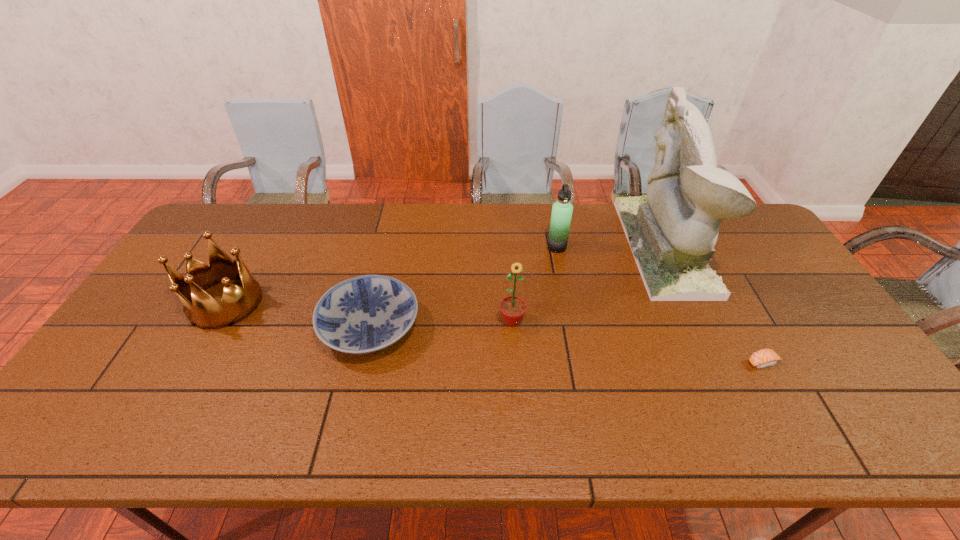
Identify the location of vacant area that lies between the fourth object from right to left and the thermos bottle. The width and height of the screenshot is (960, 540). (535, 284).

The image size is (960, 540). Find the location of `vacant space that is in between the leftmost object and the thermos bottle`. vacant space that is in between the leftmost object and the thermos bottle is located at coordinates (391, 275).

At what (x,y) coordinates should I click in order to perform the action: click on vacant area that lies between the sculpture and the sushi. Please return your answer as a coordinate pair (x, y). Image resolution: width=960 pixels, height=540 pixels. Looking at the image, I should click on (713, 305).

Locate an element on the screen. Image resolution: width=960 pixels, height=540 pixels. unoccupied position between the fourth object from left to right and the crown is located at coordinates (391, 275).

The image size is (960, 540). I want to click on object identified as the closest to the plate, so click(x=202, y=310).

The height and width of the screenshot is (540, 960). Identify the location of object that is the fifth closest to the sushi. (202, 310).

You are a GUI agent. You are given a task and a screenshot of the screen. Output one action in this format:
    pyautogui.click(x=<x>, y=<y>)
    Task: Click on the vacant space that satisfies the following two spatial constraints: 1. on the face of the shortest object; 2. on the right side of the fourth object from right to left
    
    Given the screenshot: What is the action you would take?
    click(515, 362)

Locate an element on the screen. The width and height of the screenshot is (960, 540). free space that satisfies the following two spatial constraints: 1. on the base of the sculpture; 2. on the left side of the shortest object is located at coordinates (717, 362).

What are the coordinates of `vacant region that satisfies the following two spatial constraints: 1. on the front side of the sushi; 2. on the left side of the fourth object from left to right` in the screenshot? It's located at (579, 362).

Where is `vacant region that satisfies the following two spatial constraints: 1. on the base of the tallest object; 2. on the left side of the sushi`? This screenshot has height=540, width=960. vacant region that satisfies the following two spatial constraints: 1. on the base of the tallest object; 2. on the left side of the sushi is located at coordinates (717, 362).